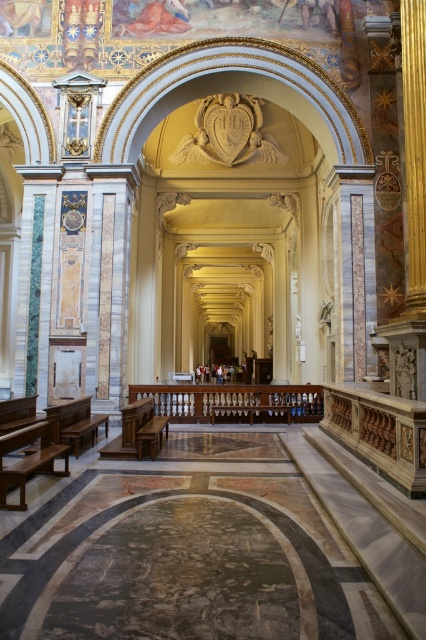
Who is more forward, (43, 474) or (85, 401)?

Point (43, 474) is in front.

Describe the element at coordinates (46, 445) in the screenshot. This screenshot has width=426, height=640. I see `wooden bench at lower left` at that location.

Find the location of a particular element. wooden bench at lower left is located at coordinates (46, 445).

Is polished wood bench at center positioned at the back of brown polished wood bench at lower left?

Yes, it is.

Based on the photo, can you confirm if polished wood bench at center is positioned to the left of brown polished wood bench at lower left?

In fact, polished wood bench at center is to the right of brown polished wood bench at lower left.

Does point (143, 432) lie in front of point (51, 428)?

That is False.

Image resolution: width=426 pixels, height=640 pixels. Find the location of `polished wood bench at center`. polished wood bench at center is located at coordinates (138, 432).

Consider the image. Is wooden bench at lower left to the right of polished wood bench at center from the viewer's perspective?

Incorrect, wooden bench at lower left is not on the right side of polished wood bench at center.

Does wooden bench at lower left have a greater width compared to polished wood bench at center?

No.

Is point (13, 422) closer to viewer compared to point (129, 429)?

No, it is not.

Locate an element on the screen. The width and height of the screenshot is (426, 640). wooden bench at lower left is located at coordinates (46, 445).